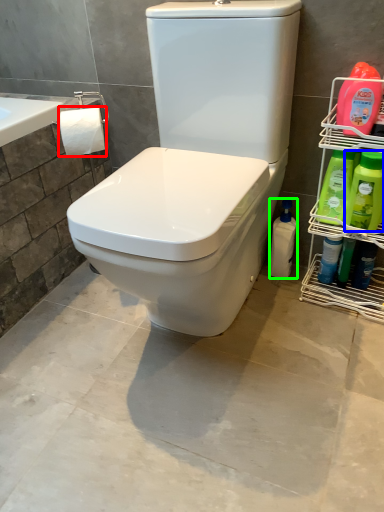
Question: Considering the real-world distances, which object is closest to toilet paper (highlighted by a red box)? cleaning product (highlighted by a blue box) or cleaning product (highlighted by a green box).

Choices:
 (A) cleaning product
 (B) cleaning product

Answer: (B)